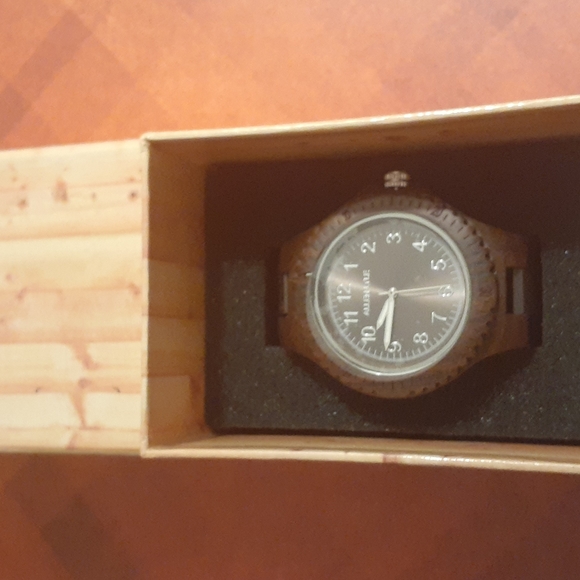
You are a GUI agent. You are given a task and a screenshot of the screen. Output one action in this format:
    pyautogui.click(x=<x>, y=<y>)
    Task: Click on the glass
    
    Given the screenshot: What is the action you would take?
    pyautogui.click(x=315, y=383)